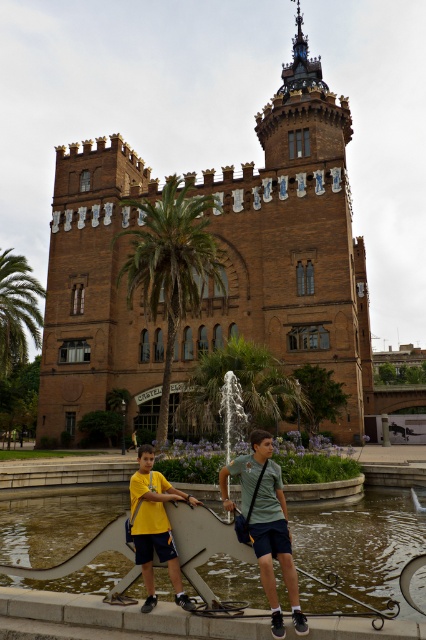
Can you confirm if yellow fabric shirt at center is wider than light gray cotton shirt at center?

Correct, the width of yellow fabric shirt at center exceeds that of light gray cotton shirt at center.

Describe the element at coordinates (267, 524) in the screenshot. I see `yellow fabric shirt at center` at that location.

In order to click on yellow fabric shirt at center in this screenshot , I will do `click(267, 524)`.

Is point (356, 381) closer to viewer compared to point (166, 365)?

Yes, it is in front of point (166, 365).

Image resolution: width=426 pixels, height=640 pixels. Identify the location of brown brick building at center. (221, 260).

Which is in front, point (291, 589) or point (150, 522)?

Positioned in front is point (291, 589).

Is yellow fabric shirt at center bigger than yellow matte shirt at center?

Yes, yellow fabric shirt at center is bigger than yellow matte shirt at center.

The height and width of the screenshot is (640, 426). What do you see at coordinates (267, 524) in the screenshot?
I see `yellow fabric shirt at center` at bounding box center [267, 524].

In order to click on yellow fabric shirt at center in this screenshot , I will do `click(267, 524)`.